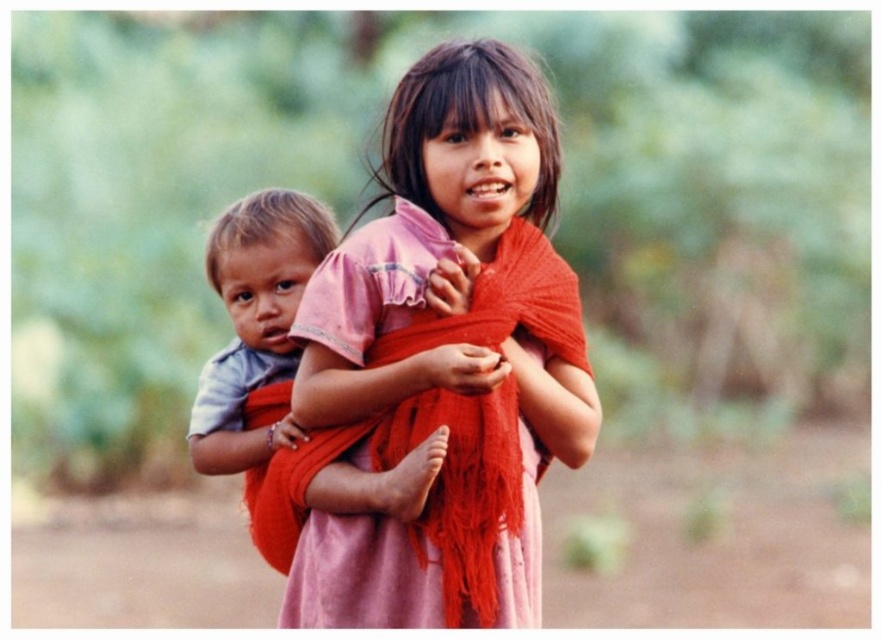
You are a photographer trying to capture a closeup of the matte pink dress at center and the matte pink shirt at center. Since the camera can only focus on one object at a time, which one should you choose to ensure the subject is in focus if you want the taller object to be sharp?

The matte pink dress at center is much taller than the matte pink shirt at center, so you should focus on the matte pink dress at center to ensure the taller object is in focus.

You are a photographer trying to capture a closeup of the matte pink dress at center and the matte pink shirt at center. Since both are pink, how can you tell them apart based on their positions?

The matte pink dress at center is positioned over the matte pink shirt at center, so the dress is visible above the shirt.

You are a photographer trying to capture a closeup of the matte pink dress at center and the matte pink shirt at center. Since the camera can only focus on one object at a time, which one should you choose to ensure the larger object is in focus?

The matte pink dress at center is larger in size than the matte pink shirt at center, so you should focus on the matte pink dress at center to ensure the larger object is in focus.